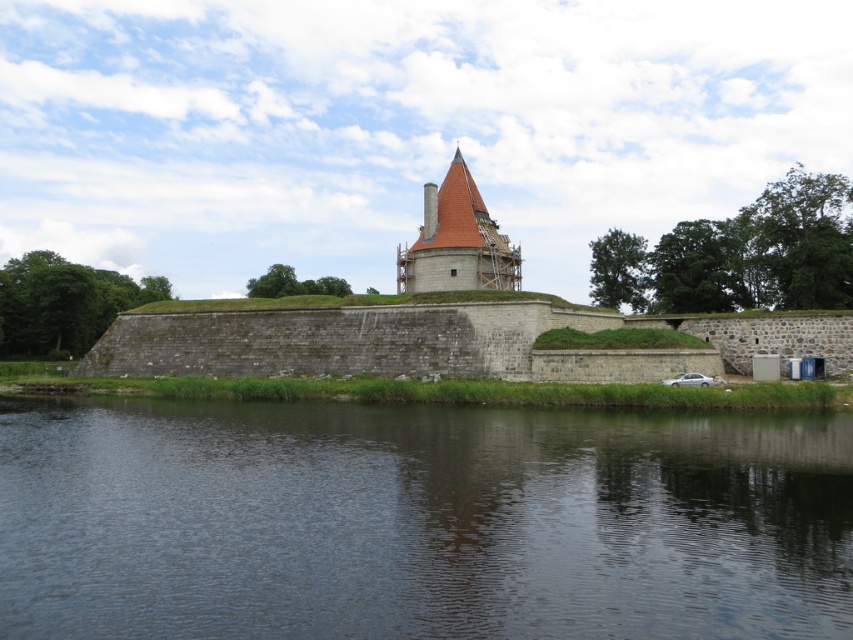
Based on the photo, can you confirm if dark water at lower center is bigger than brown tiled tower at center?

Yes, dark water at lower center is bigger than brown tiled tower at center.

Who is higher up, dark water at lower center or brown tiled tower at center?

brown tiled tower at center is above.

Looking at this image, who is more forward, [90,488] or [515,278]?

Point [90,488] is more forward.

You are a GUI agent. You are given a task and a screenshot of the screen. Output one action in this format:
    pyautogui.click(x=<x>, y=<y>)
    Task: Click on the dark water at lower center
    The image size is (853, 640).
    Given the screenshot: What is the action you would take?
    pyautogui.click(x=419, y=522)